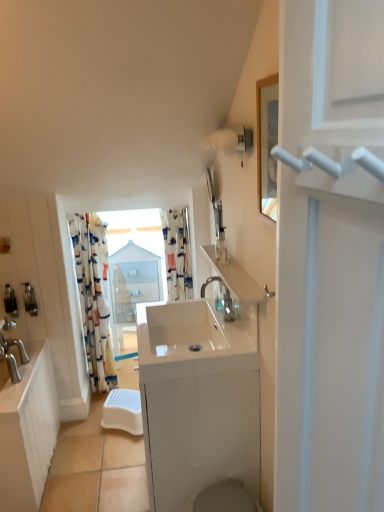
Question: In terms of size, does white glossy sink at left, which is counted as the 1th counter top, starting from the left, appear bigger or smaller than satin nickel faucet at center?

Choices:
 (A) big
 (B) small

Answer: (A)

Question: From a real-world perspective, is white glossy sink at left, which ranks as the second counter top in right-to-left order, positioned above or below satin nickel faucet at center?

Choices:
 (A) below
 (B) above

Answer: (A)

Question: Estimate the real-world distances between objects in this image. Which object is farther from the floral fabric curtain at center, arranged as the second curtain when viewed from the right?

Choices:
 (A) white plastic step stool at center
 (B) satin nickel faucet at center
 (C) metallic silver soap dispenser at left, the 2th toiletry positioned from the back
 (D) white glossy sink at center, the 2th counter top positioned from the left
 (E) transparent glass window at center

Answer: (D)

Question: Estimate the real-world distances between objects in this image. Which object is farther from the transparent glass window at center?

Choices:
 (A) white plastic step stool at center
 (B) clear plastic bottle at upper center, the first toiletry viewed from the right
 (C) metallic silver soap dispenser at left, the 1th toiletry in the left-to-right sequence
 (D) white glossy sink at left, which ranks as the second counter top in right-to-left order
 (E) white glossy sink at center

Answer: (B)